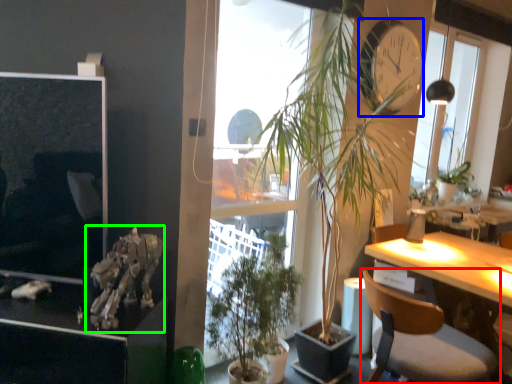
Question: Which object is the farthest from chair (highlighted by a red box)? Choose among these: clock (highlighted by a blue box) or skeleton (highlighted by a green box).

Choices:
 (A) clock
 (B) skeleton

Answer: (B)